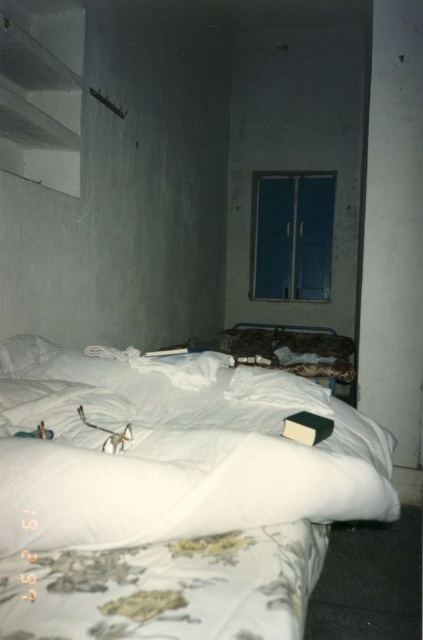
Does white fabric bed at center appear over white soft pillow at upper left?

No.

Can you confirm if white fabric bed at center is thinner than white soft pillow at upper left?

Incorrect, white fabric bed at center's width is not less than white soft pillow at upper left's.

Is point (230, 369) behind point (10, 372)?

That is True.

Where is `white fabric bed at center`? white fabric bed at center is located at coordinates (173, 499).